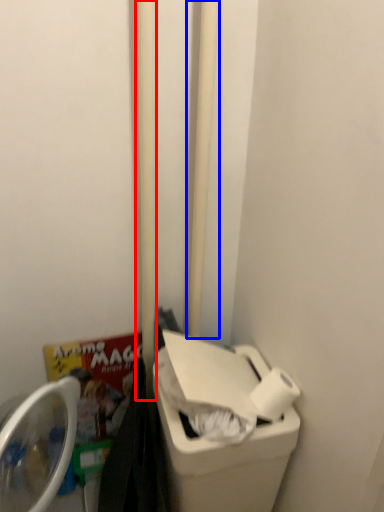
Question: Which object is further to the camera taking this photo, pole (highlighted by a red box) or pole (highlighted by a blue box)?

Choices:
 (A) pole
 (B) pole

Answer: (B)